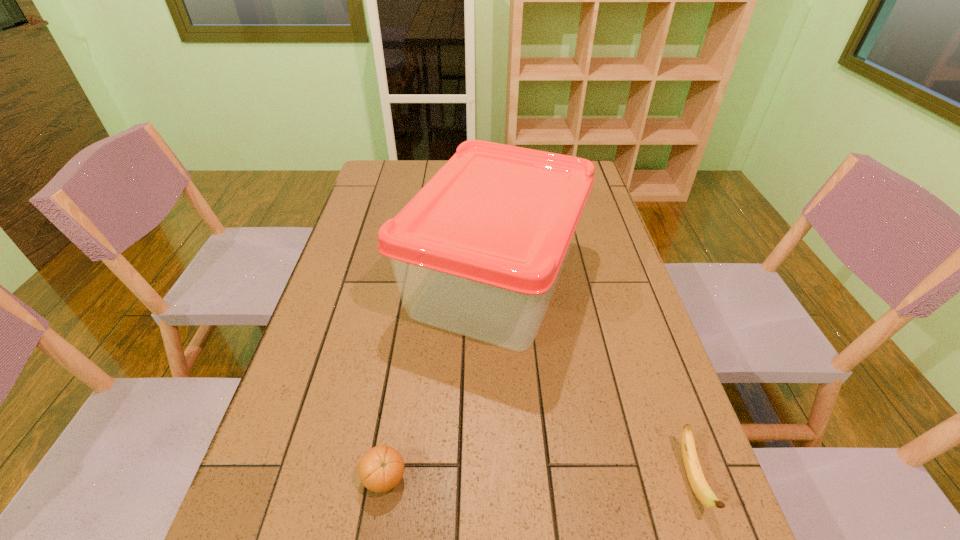
Identify the location of the tallest object. (479, 250).

Where is `tray`? The image size is (960, 540). tray is located at coordinates (479, 250).

Locate an element on the screen. orange is located at coordinates (381, 468).

Identify the location of the rightmost object. (695, 475).

Locate an element on the screen. The image size is (960, 540). blank space located 0.340m on the front of the tallest object is located at coordinates (505, 531).

The height and width of the screenshot is (540, 960). In order to click on vacant point located 0.050m on the back of the orange in this screenshot , I will do `click(392, 434)`.

The image size is (960, 540). I want to click on tray at the right edge, so click(479, 250).

The image size is (960, 540). Identify the location of banana present at the right edge. [x=695, y=475].

Identify the location of vacant space at the left edge of the desktop. (367, 210).

This screenshot has height=540, width=960. Find the location of `vacant area at the right edge`. vacant area at the right edge is located at coordinates (605, 328).